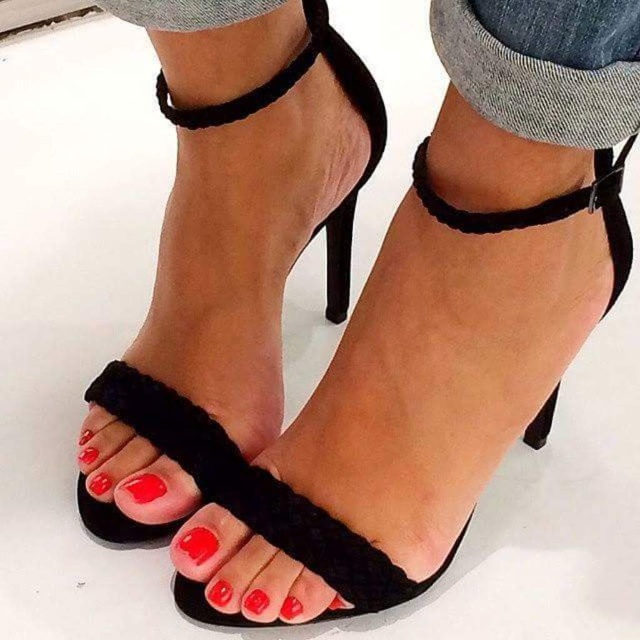
Can you confirm if suede black sandal at center is positioned to the right of velvet strap at center?

In fact, suede black sandal at center is to the left of velvet strap at center.

Consider the image. Between suede black sandal at center and velvet strap at center, which one has more height?

suede black sandal at center

Who is more forward, (150,534) or (548,221)?

Point (548,221)

Locate an element on the screen. suede black sandal at center is located at coordinates (252, 202).

Between suede black sandal at center and matte black toe at center, which one has more height?

Standing taller between the two is suede black sandal at center.

Between suede black sandal at center and matte black toe at center, which one is positioned higher?

suede black sandal at center is higher up.

The image size is (640, 640). Find the location of `suede black sandal at center`. suede black sandal at center is located at coordinates [x=252, y=202].

At what (x,y) coordinates should I click in order to perform the action: click on suede black sandal at center. Please return your answer as a coordinate pair (x, y). Looking at the image, I should click on (252, 202).

Is glossy red nail polish at center above matte black toe at center?

Yes, glossy red nail polish at center is above matte black toe at center.

Does glossy red nail polish at center have a larger size compared to matte black toe at center?

Yes.

This screenshot has height=640, width=640. In order to click on glossy red nail polish at center in this screenshot , I will do `click(141, 492)`.